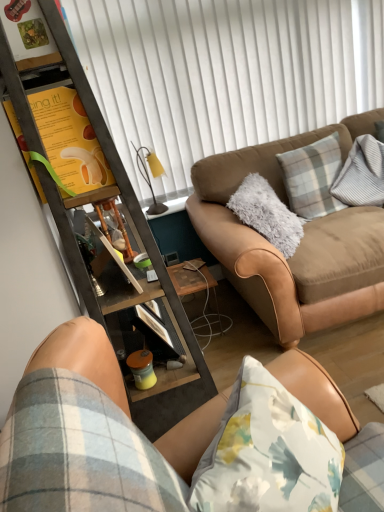
Question: Considering the relative sizes of white matte shutter at upper center and matte yellow cup at lower center in the image provided, is white matte shutter at upper center taller than matte yellow cup at lower center?

Choices:
 (A) no
 (B) yes

Answer: (B)

Question: Is white matte shutter at upper center turned away from matte yellow cup at lower center?

Choices:
 (A) no
 (B) yes

Answer: (A)

Question: Can you confirm if white matte shutter at upper center is bigger than matte yellow cup at lower center?

Choices:
 (A) no
 (B) yes

Answer: (B)

Question: Is white matte shutter at upper center at the left side of matte yellow cup at lower center?

Choices:
 (A) yes
 (B) no

Answer: (B)

Question: Does white matte shutter at upper center have a lesser width compared to matte yellow cup at lower center?

Choices:
 (A) no
 (B) yes

Answer: (B)

Question: Is white matte shutter at upper center outside matte yellow cup at lower center?

Choices:
 (A) no
 (B) yes

Answer: (B)

Question: Can you confirm if suede tan couch at lower right, which is the first studio couch from front to back, is wider than wooden side table at lower center?

Choices:
 (A) yes
 (B) no

Answer: (A)

Question: Does suede tan couch at lower right, which is the first studio couch from front to back, have a lesser width compared to wooden side table at lower center?

Choices:
 (A) yes
 (B) no

Answer: (B)

Question: Is suede tan couch at lower right, the second studio couch viewed from the back, not near wooden side table at lower center?

Choices:
 (A) no
 (B) yes

Answer: (B)

Question: From a real-world perspective, is suede tan couch at lower right, the second studio couch viewed from the back, positioned over wooden side table at lower center based on gravity?

Choices:
 (A) yes
 (B) no

Answer: (A)

Question: From the image's perspective, is suede tan couch at lower right, the second studio couch viewed from the back, above wooden side table at lower center?

Choices:
 (A) yes
 (B) no

Answer: (B)

Question: Considering the relative sizes of suede tan couch at lower right, the second studio couch viewed from the back, and wooden side table at lower center in the image provided, is suede tan couch at lower right, the second studio couch viewed from the back, shorter than wooden side table at lower center?

Choices:
 (A) no
 (B) yes

Answer: (A)

Question: Can we say matte yellow cup at lower center lies outside yellow paper at upper left?

Choices:
 (A) no
 (B) yes

Answer: (B)